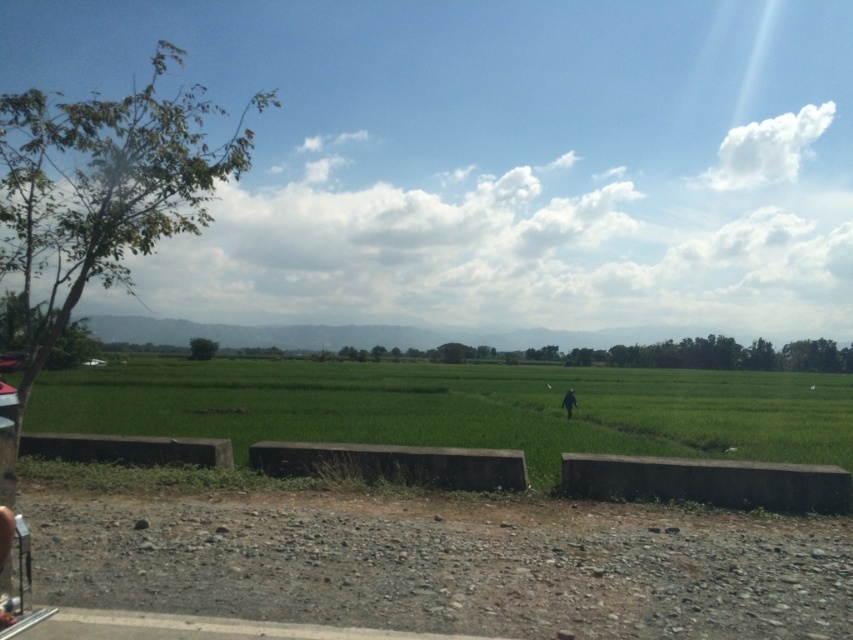
Question: Can you confirm if green grass field at center is positioned to the left of dark green grass at center?

Choices:
 (A) no
 (B) yes

Answer: (B)

Question: Which point appears closest to the camera in this image?

Choices:
 (A) (572, 403)
 (B) (608, 381)

Answer: (A)

Question: Which point is closer to the camera?

Choices:
 (A) (160, 433)
 (B) (575, 404)

Answer: (A)

Question: Is green grass field at center closer to the viewer compared to dark green grass at center?

Choices:
 (A) yes
 (B) no

Answer: (A)

Question: Which point is closer to the camera?

Choices:
 (A) (563, 397)
 (B) (165, 392)

Answer: (A)

Question: From the image, what is the correct spatial relationship of green grass field at center in relation to dark green grass at center?

Choices:
 (A) right
 (B) left

Answer: (B)